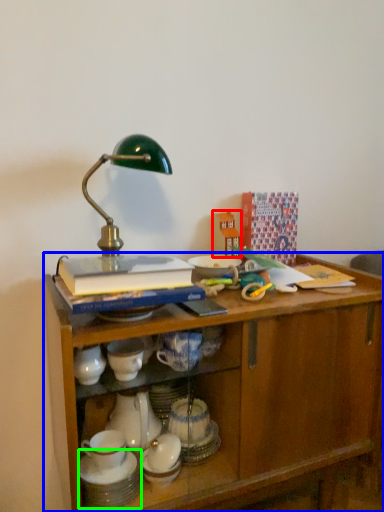
Question: Which object is the closest to the toy (highlighted by a red box)? Choose among these: desk (highlighted by a blue box) or tableware (highlighted by a green box).

Choices:
 (A) desk
 (B) tableware

Answer: (A)